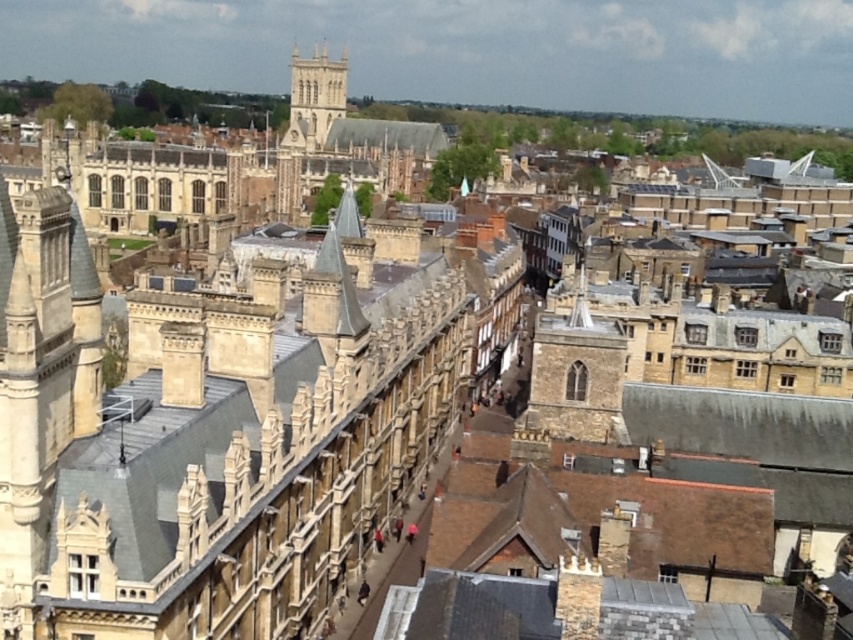
Question: In this image, where is brown stone tower at center-right located relative to golden stone tower at upper center?

Choices:
 (A) left
 (B) right

Answer: (B)

Question: Which point appears farthest from the camera in this image?

Choices:
 (A) (321, 134)
 (B) (560, 321)

Answer: (A)

Question: Does brown stone tower at center-right appear on the left side of golden stone tower at upper center?

Choices:
 (A) no
 (B) yes

Answer: (A)

Question: Does brown stone tower at center-right appear on the right side of golden stone tower at upper center?

Choices:
 (A) no
 (B) yes

Answer: (B)

Question: Which object appears closest to the camera in this image?

Choices:
 (A) brown stone tower at center-right
 (B) golden stone tower at upper center

Answer: (A)

Question: Which object is farther from the camera taking this photo?

Choices:
 (A) brown stone tower at center-right
 (B) golden stone tower at upper center

Answer: (B)